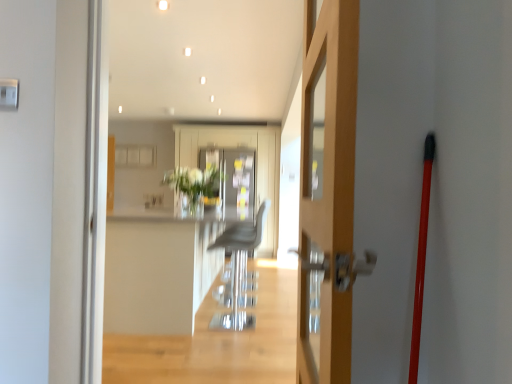
Question: Can you confirm if translucent glass vase at center is taller than wooden door at center?

Choices:
 (A) no
 (B) yes

Answer: (A)

Question: From a real-world perspective, does translucent glass vase at center stand above wooden door at center?

Choices:
 (A) no
 (B) yes

Answer: (B)

Question: Can you confirm if translucent glass vase at center is bigger than wooden door at center?

Choices:
 (A) no
 (B) yes

Answer: (A)

Question: Considering the relative positions of translucent glass vase at center and wooden door at center in the image provided, is translucent glass vase at center behind wooden door at center?

Choices:
 (A) yes
 (B) no

Answer: (A)

Question: Is translucent glass vase at center oriented away from wooden door at center?

Choices:
 (A) yes
 (B) no

Answer: (B)

Question: Is there a large distance between translucent glass vase at center and wooden door at center?

Choices:
 (A) yes
 (B) no

Answer: (A)

Question: From a real-world perspective, is metallic gray armchair at center located beneath translucent glass vase at center?

Choices:
 (A) yes
 (B) no

Answer: (A)

Question: Is metallic gray armchair at center wider than translucent glass vase at center?

Choices:
 (A) no
 (B) yes

Answer: (A)

Question: Is metallic gray armchair at center positioned far away from translucent glass vase at center?

Choices:
 (A) no
 (B) yes

Answer: (A)

Question: Is metallic gray armchair at center smaller than translucent glass vase at center?

Choices:
 (A) yes
 (B) no

Answer: (B)

Question: Does metallic gray armchair at center have a greater height compared to translucent glass vase at center?

Choices:
 (A) yes
 (B) no

Answer: (A)

Question: Could you tell me if metallic gray armchair at center is facing translucent glass vase at center?

Choices:
 (A) no
 (B) yes

Answer: (A)

Question: Is white glossy counter top at center at the right side of translucent glass vase at center?

Choices:
 (A) no
 (B) yes

Answer: (A)